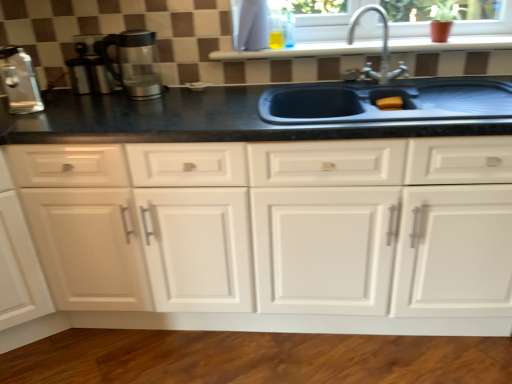
Question: Looking at the image, does white glossy window sill at upper center seem bigger or smaller compared to transparent glass coffee maker at left, which is the second coffee machine from left to right?

Choices:
 (A) big
 (B) small

Answer: (A)

Question: From the image's perspective, is white glossy window sill at upper center located above or below transparent glass coffee maker at left, which is the second coffee machine from left to right?

Choices:
 (A) below
 (B) above

Answer: (B)

Question: Which object is positioned closest to the white plastic window frame at upper center?

Choices:
 (A) satin nickel faucet at upper right
 (B) white matte cabinet at center
 (C) satin silver coffee machine at left, positioned as the 1th coffee machine in left-to-right order
 (D) transparent glass coffee maker at left, which is the second coffee machine from left to right
 (E) black matte sink at center

Answer: (A)

Question: Estimate the real-world distances between objects in this image. Which object is farther from the black matte sink at center?

Choices:
 (A) satin nickel faucet at upper right
 (B) white glossy window sill at upper center
 (C) white matte cabinet at center
 (D) transparent glass coffee maker at left, which is the second coffee machine from left to right
 (E) satin silver coffee machine at left, positioned as the 1th coffee machine in left-to-right order

Answer: (E)